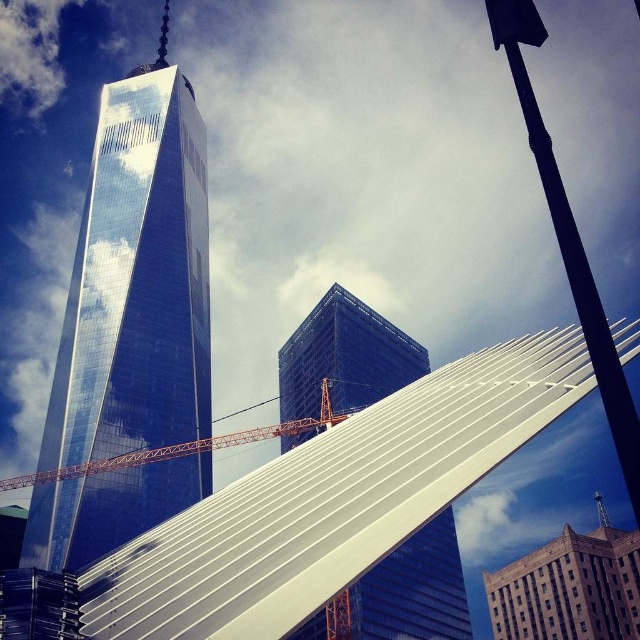
You are an architect evaluating two skyscrapers in the city. The shiny glass skyscraper at center and the dark blue glass skyscraper at center. Which one has a larger footprint?

The shiny glass skyscraper at center is bigger than dark blue glass skyscraper at center, so it has a larger footprint.

You are a drone operator tasked with capturing aerial footage of the dark blue glass skyscraper at center. The drone must fly from the construction crane in the foreground to the skyscraper. Based on their positions, will the drone have a clear path to the skyscraper without obstacles?

The dark blue glass skyscraper at center is located at point (344, 356). Since the construction crane is in the foreground, it is closer to the viewer, so the drone can fly over or around it to reach the skyscraper at center without obstruction.

You are a drone operator tasked with capturing aerial footage of the dark blue glass skyscraper at center. Your drone is currently at point coordinates of (344, 356). Is the dark blue glass skyscraper at center directly below you?

The point coordinates of (344, 356) is where the dark blue glass skyscraper at center is located, so yes, the dark blue glass skyscraper at center is directly below you.